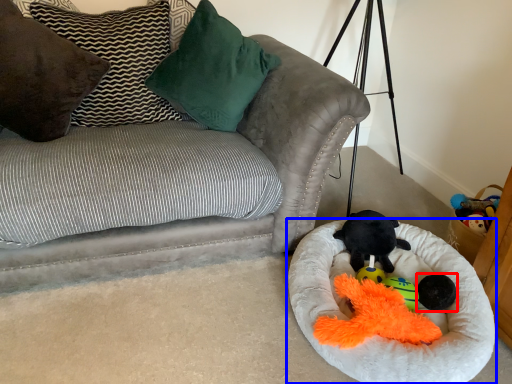
Question: Which point is further to the camera, toy (highlighted by a red box) or dog bed (highlighted by a blue box)?

Choices:
 (A) toy
 (B) dog bed

Answer: (A)